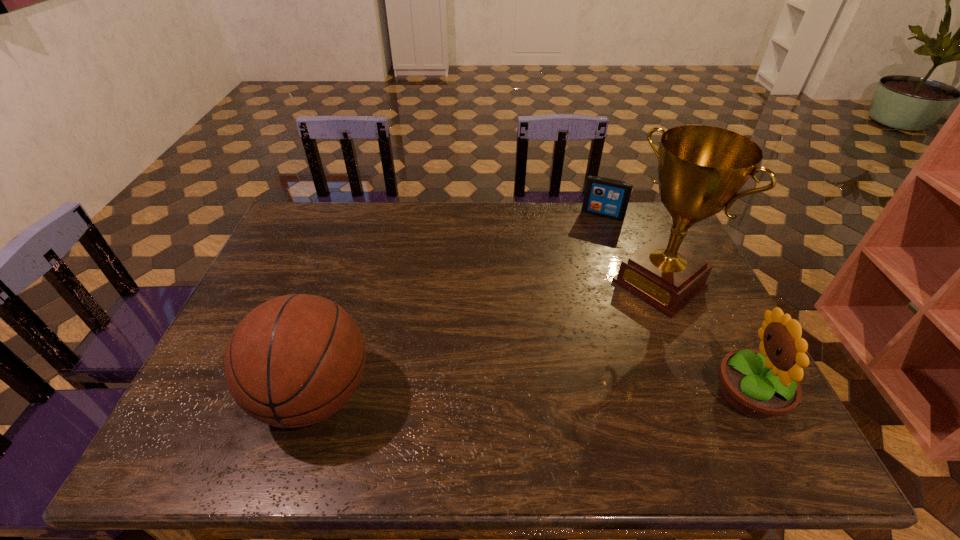
The width and height of the screenshot is (960, 540). What are the coordinates of `object that is the third closest one to the leftmost object` in the screenshot? It's located at (604, 197).

I want to click on blank space that satisfies the following two spatial constraints: 1. on the front side of the sunflower; 2. on the face of the iPod, so click(x=665, y=395).

This screenshot has height=540, width=960. In order to click on free space that satisfies the following two spatial constraints: 1. on the front side of the award; 2. on the face of the sunflower in this screenshot , I will do `click(708, 395)`.